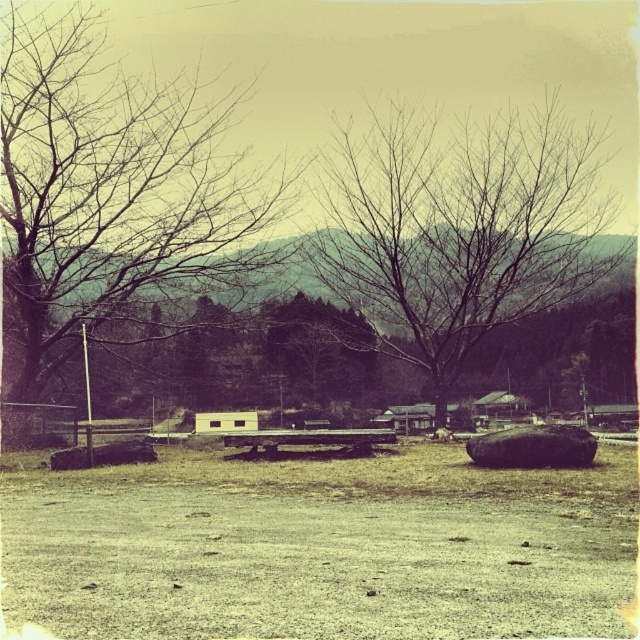
Who is lower down, brown dirt field at center or wooden picnic table at center?

Positioned lower is brown dirt field at center.

Is brown dirt field at center closer to camera compared to wooden picnic table at center?

That is True.

Is point (381, 628) closer to camera compared to point (252, 445)?

That is True.

This screenshot has height=640, width=640. In order to click on brown dirt field at center in this screenshot , I will do `click(321, 547)`.

Which is more to the left, bare branches at left or smooth brown rock at center?

From the viewer's perspective, bare branches at left appears more on the left side.

The width and height of the screenshot is (640, 640). What do you see at coordinates (113, 193) in the screenshot?
I see `bare branches at left` at bounding box center [113, 193].

Find the location of `bare branches at left`. bare branches at left is located at coordinates (113, 193).

Is point (522, 216) closer to viewer compared to point (538, 442)?

No, it is behind (538, 442).

Between point (346, 298) and point (550, 451), which one is positioned behind?

The point (346, 298) is more distant.

Is point (456, 333) less distant than point (481, 454)?

That is False.

This screenshot has width=640, height=640. In order to click on bare branches at center in this screenshot , I will do `click(458, 228)`.